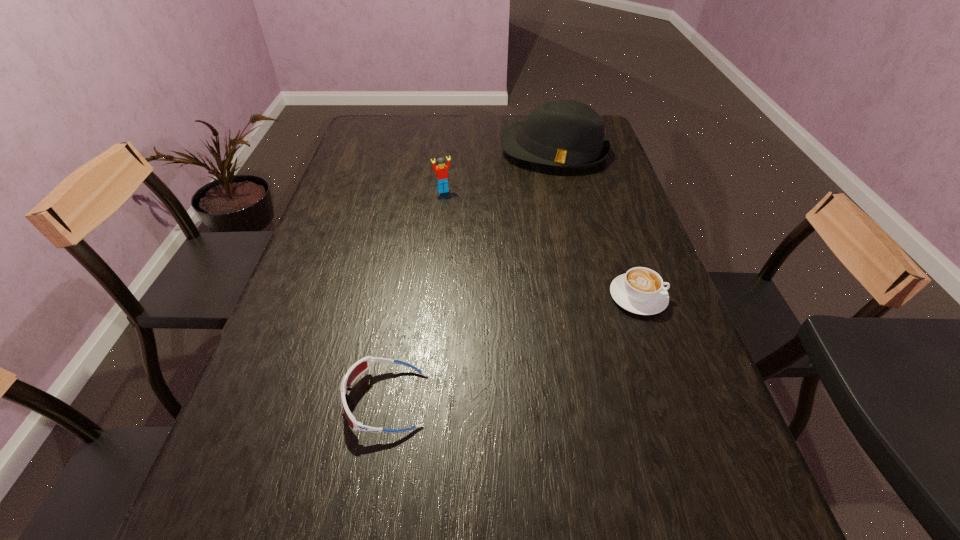
I want to click on goggles, so click(x=357, y=369).

Where is `cappuccino`? The image size is (960, 540). cappuccino is located at coordinates (640, 291).

The width and height of the screenshot is (960, 540). What are the coordinates of `Lego` in the screenshot? It's located at (441, 169).

Where is `the third shortest object`? This screenshot has width=960, height=540. the third shortest object is located at coordinates (441, 169).

The width and height of the screenshot is (960, 540). I want to click on the farthest object, so click(569, 134).

Identify the location of the tallest object. The image size is (960, 540). (569, 134).

Where is `vacant space positioned 0.110m on the front-facing side of the goggles`? vacant space positioned 0.110m on the front-facing side of the goggles is located at coordinates (288, 400).

Identify the location of vacant region located 0.140m on the front-facing side of the goggles. (273, 400).

Find the location of `vacant region located on the face of the third nearest object`. vacant region located on the face of the third nearest object is located at coordinates (460, 220).

You are a GUI agent. You are given a task and a screenshot of the screen. Output one action in this format:
    pyautogui.click(x=<x>, y=<y>)
    Task: Click on the vacant space located on the face of the third nearest object
    This screenshot has width=960, height=540.
    Given the screenshot: What is the action you would take?
    pyautogui.click(x=475, y=251)